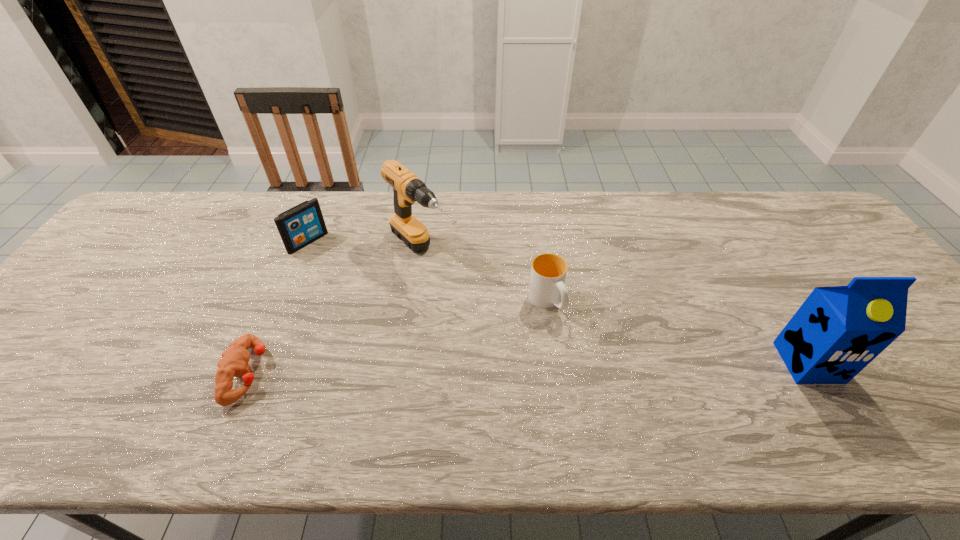
You are a GUI agent. You are given a task and a screenshot of the screen. Output one action in this format:
    pyautogui.click(x=<x>, y=<y>)
    Task: Click on the puncher
    
    Given the screenshot: What is the action you would take?
    pyautogui.click(x=234, y=360)

This screenshot has height=540, width=960. Identify the location of the rightmost object. (838, 330).

I want to click on the third object from right to left, so click(x=407, y=188).

This screenshot has width=960, height=540. I want to click on iPod, so click(302, 224).

Locate an element on the screen. Image resolution: width=960 pixels, height=540 pixels. the third farthest object is located at coordinates (548, 272).

At what (x,y) coordinates should I click in order to perform the action: click on the second object from right to left. Please return your answer as a coordinate pair (x, y). This screenshot has width=960, height=540. Looking at the image, I should click on (548, 272).

Identify the location of vacant space located 0.170m with the gloves of the shortest object facing forward. This screenshot has height=540, width=960. (341, 373).

You are a GUI agent. You are given a task and a screenshot of the screen. Output one action in this format:
    pyautogui.click(x=<x>, y=<y>)
    Task: Click on the vacant space located at the tip of the drill
    The image size is (960, 540).
    Given the screenshot: What is the action you would take?
    pyautogui.click(x=497, y=320)

Locate an element on the screen. vacant position located at the tip of the drill is located at coordinates (490, 313).

The height and width of the screenshot is (540, 960). Find the location of `vacant space positioned at the tip of the drill`. vacant space positioned at the tip of the drill is located at coordinates (519, 340).